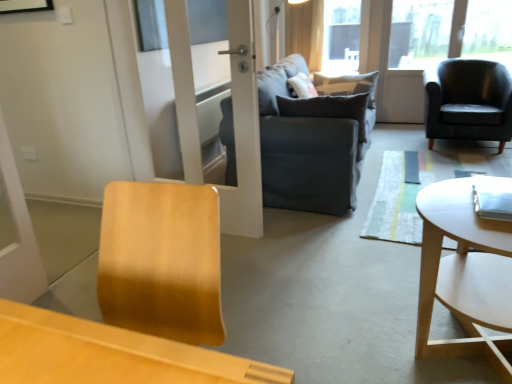
Question: From the image's perspective, would you say transparent glass window screen at upper center is shown under light beige fabric curtain at upper center?

Choices:
 (A) no
 (B) yes

Answer: (A)

Question: Can you confirm if transparent glass window screen at upper center is bigger than light beige fabric curtain at upper center?

Choices:
 (A) yes
 (B) no

Answer: (B)

Question: Is transparent glass window screen at upper center completely or partially outside of light beige fabric curtain at upper center?

Choices:
 (A) no
 (B) yes

Answer: (B)

Question: Does transparent glass window screen at upper center appear on the right side of light beige fabric curtain at upper center?

Choices:
 (A) yes
 (B) no

Answer: (A)

Question: From a real-world perspective, is transparent glass window screen at upper center physically above light beige fabric curtain at upper center?

Choices:
 (A) yes
 (B) no

Answer: (B)

Question: Is transparent glass window screen at upper center wider than light beige fabric curtain at upper center?

Choices:
 (A) no
 (B) yes

Answer: (A)

Question: Is white wood coffee table at right further to the viewer compared to light beige fabric curtain at upper center?

Choices:
 (A) no
 (B) yes

Answer: (A)

Question: Does white wood coffee table at right come in front of light beige fabric curtain at upper center?

Choices:
 (A) no
 (B) yes

Answer: (B)

Question: Is white wood coffee table at right looking in the opposite direction of light beige fabric curtain at upper center?

Choices:
 (A) no
 (B) yes

Answer: (A)

Question: From a real-world perspective, is white wood coffee table at right physically above light beige fabric curtain at upper center?

Choices:
 (A) yes
 (B) no

Answer: (B)

Question: Is white wood coffee table at right wider than light beige fabric curtain at upper center?

Choices:
 (A) yes
 (B) no

Answer: (A)

Question: From a real-world perspective, is white wood coffee table at right under light beige fabric curtain at upper center?

Choices:
 (A) yes
 (B) no

Answer: (A)

Question: Is dark gray fabric couch at center directly adjacent to dark gray fabric pillow at center?

Choices:
 (A) yes
 (B) no

Answer: (B)